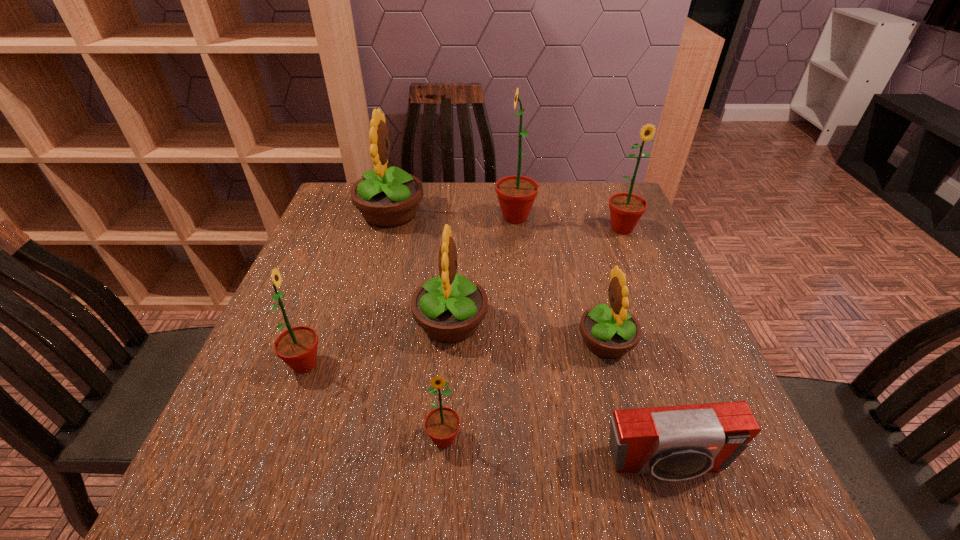
Image resolution: width=960 pixels, height=540 pixels. In order to click on vacant position located on the face of the leftmost green sunflower in this screenshot , I will do `click(387, 364)`.

This screenshot has height=540, width=960. I want to click on free point located on the face of the sixth sunflower from left to right, so click(x=484, y=341).

At what (x,y) coordinates should I click in order to perform the action: click on free space located 0.360m on the face of the sixth sunflower from left to right. Please return your answer as a coordinate pair (x, y). Looking at the image, I should click on (401, 341).

Locate an element on the screen. vacant point located on the face of the sixth sunflower from left to right is located at coordinates (490, 341).

Find the location of a particular element. vacant area situated on the face of the second green sunflower from left to right is located at coordinates (440, 507).

I want to click on object that is at the near edge, so click(673, 443).

Where is `camera at the right edge`? This screenshot has height=540, width=960. camera at the right edge is located at coordinates (673, 443).

Identify the location of object positioned at the far left corner. Image resolution: width=960 pixels, height=540 pixels. (386, 198).

Locate an element on the screen. The height and width of the screenshot is (540, 960). object situated at the far right corner is located at coordinates (626, 209).

At what (x,y) coordinates should I click in order to perform the action: click on object that is positioned at the near right corner. Please return your answer as a coordinate pair (x, y). This screenshot has width=960, height=540. Looking at the image, I should click on (673, 443).